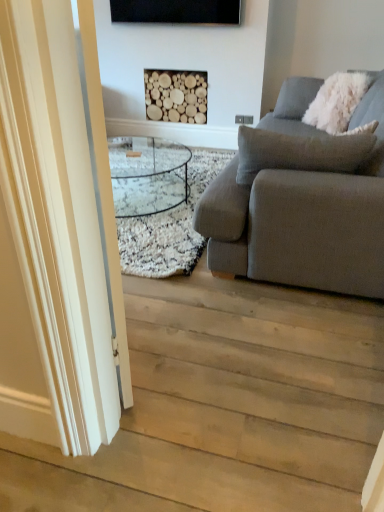
Image resolution: width=384 pixels, height=512 pixels. What do you see at coordinates (301, 202) in the screenshot?
I see `gray fabric couch at right` at bounding box center [301, 202].

Find the location of a particular element. The height and width of the screenshot is (512, 384). white fluffy pillow at upper right is located at coordinates (337, 101).

Image resolution: width=384 pixels, height=512 pixels. Identify the location of natural wood logs at upper center. (176, 96).

Is light wood floor at lower left directly adjacent to white fluffy pillow at upper right?

No, light wood floor at lower left is not next to white fluffy pillow at upper right.

From the image's perspective, is light wood floor at lower left positioned above or below white fluffy pillow at upper right?

Clearly, from the image's perspective, light wood floor at lower left is below white fluffy pillow at upper right.

Does light wood floor at lower left have a greater width compared to white fluffy pillow at upper right?

Correct, the width of light wood floor at lower left exceeds that of white fluffy pillow at upper right.

You are a GUI agent. You are given a task and a screenshot of the screen. Output one action in this format:
    pyautogui.click(x=<x>, y=<y>)
    Task: Click on the stairwell on the left side of white fluffy pillow at upper right
    
    Given the screenshot: What is the action you would take?
    pyautogui.click(x=226, y=406)

In the scene shown: Which of these two, gray fabric couch at right or white glossy door at left, is wider?

gray fabric couch at right.

Is gray fabric couch at right next to white glossy door at left?

No, gray fabric couch at right is not with white glossy door at left.

Would you say gray fabric couch at right is outside white glossy door at left?

Absolutely, gray fabric couch at right is external to white glossy door at left.

Image resolution: width=384 pixels, height=512 pixels. Identify the location of studio couch on the right of white glossy door at left. (301, 202).

Is white glossy door at left in front of or behind gray fabric couch at right in the image?

white glossy door at left is in front of gray fabric couch at right.

In terms of width, does white glossy door at left look wider or thinner when compared to gray fabric couch at right?

In the image, white glossy door at left appears to be more narrow than gray fabric couch at right.

Is white glossy door at left far away from gray fabric couch at right?

Indeed, white glossy door at left is not near gray fabric couch at right.

Considering the sizes of white glossy door at left and gray fabric couch at right in the image, is white glossy door at left taller or shorter than gray fabric couch at right?

In the image, white glossy door at left appears to be taller than gray fabric couch at right.

From a real-world perspective, who is located higher, gray fabric couch at right or white fluffy pillow at upper right?

white fluffy pillow at upper right is physically above.

What's the angular difference between gray fabric couch at right and white fluffy pillow at upper right's facing directions?

The angular difference between gray fabric couch at right and white fluffy pillow at upper right is 39.7 degrees.

Which of these two, gray fabric couch at right or white fluffy pillow at upper right, is thinner?

white fluffy pillow at upper right.

Between gray fabric couch at right and white fluffy pillow at upper right, which one has larger size?

gray fabric couch at right.

Does point (76, 221) appear closer or farther from the camera than point (172, 88)?

Point (76, 221) is positioned closer to the camera compared to point (172, 88).

How much distance is there between white glossy door at left and natural wood logs at upper center?

A distance of 11.60 feet exists between white glossy door at left and natural wood logs at upper center.

Is white glossy door at left inside the boundaries of natural wood logs at upper center, or outside?

white glossy door at left is spatially situated outside natural wood logs at upper center.

Is there a large distance between white glossy door at left and natural wood logs at upper center?

Yes, white glossy door at left and natural wood logs at upper center are located far from each other.

How distant is white fluffy pillow at upper right from natural wood logs at upper center?

white fluffy pillow at upper right is 1.43 meters from natural wood logs at upper center.

Considering the sizes of white fluffy pillow at upper right and natural wood logs at upper center in the image, is white fluffy pillow at upper right bigger or smaller than natural wood logs at upper center?

Result: In the image, white fluffy pillow at upper right appears to be larger than natural wood logs at upper center.

From a real-world perspective, which is physically below, white fluffy pillow at upper right or natural wood logs at upper center?

natural wood logs at upper center is physically lower.

Between white fluffy pillow at upper right and natural wood logs at upper center, which one is positioned in front?

Positioned in front is white fluffy pillow at upper right.

From the picture: From a real-world perspective, is white glossy door at left located beneath white fluffy pillow at upper right?

No, from a real-world perspective, white glossy door at left is not beneath white fluffy pillow at upper right.

Is white glossy door at left not near white fluffy pillow at upper right?

Indeed, white glossy door at left is not near white fluffy pillow at upper right.

Can you confirm if white glossy door at left is shorter than white fluffy pillow at upper right?

No.

Locate an element on the screen. stairwell that appears below the white fluffy pillow at upper right (from the image's perspective) is located at coordinates (226, 406).

Find the location of a particular element. The height and width of the screenshot is (512, 384). glass door in front of the gray fabric couch at right is located at coordinates (50, 241).

From the image, which object appears to be nearer to light wood floor at lower left, gray fabric couch at right or white glossy door at left?

white glossy door at left is positioned closer to the anchor light wood floor at lower left.

Considering their positions, is natural wood logs at upper center positioned closer to light wood floor at lower left than gray fabric couch at right?

gray fabric couch at right is closer to light wood floor at lower left.

Looking at the image, which one is located closer to gray fabric couch at right, white fluffy pillow at upper right or light wood floor at lower left?

light wood floor at lower left is positioned closer to the anchor gray fabric couch at right.

When comparing their distances from light wood floor at lower left, does white fluffy pillow at upper right or natural wood logs at upper center seem closer?

Among the two, white fluffy pillow at upper right is located nearer to light wood floor at lower left.

Considering their positions, is white glossy door at left positioned further to white fluffy pillow at upper right than natural wood logs at upper center?

The object further to white fluffy pillow at upper right is white glossy door at left.

Estimate the real-world distances between objects in this image. Which object is closer to white glossy door at left, light wood floor at lower left or gray fabric couch at right?

The object closer to white glossy door at left is light wood floor at lower left.

Considering their positions, is light wood floor at lower left positioned closer to white glossy door at left than natural wood logs at upper center?

light wood floor at lower left lies closer to white glossy door at left than the other object.

When comparing their distances from gray fabric couch at right, does white fluffy pillow at upper right or natural wood logs at upper center seem further?

natural wood logs at upper center.

The height and width of the screenshot is (512, 384). Identify the location of studio couch located between light wood floor at lower left and natural wood logs at upper center in the depth direction. (301, 202).

Find the location of `stairwell between white glossy door at left and white fluffy pillow at upper right along the z-axis`. stairwell between white glossy door at left and white fluffy pillow at upper right along the z-axis is located at coordinates (226, 406).

This screenshot has width=384, height=512. Identify the location of pillow located between gray fabric couch at right and natural wood logs at upper center in the depth direction. (337, 101).

Image resolution: width=384 pixels, height=512 pixels. I want to click on pillow positioned between light wood floor at lower left and natural wood logs at upper center from near to far, so click(x=337, y=101).